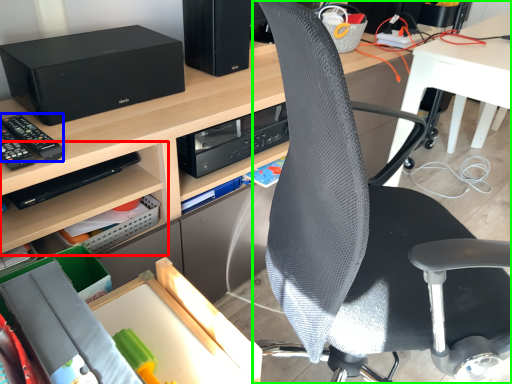
Question: Based on their relative distances, which object is farther from shelf (highlighted by a red box)? Choose from equipment (highlighted by a blue box) and chair (highlighted by a green box).

Choices:
 (A) equipment
 (B) chair

Answer: (B)